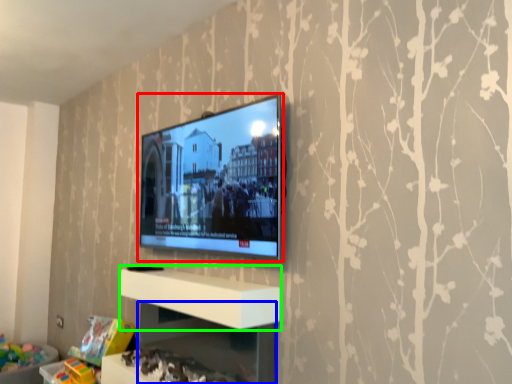
Question: Which is nearer to the television (highlighted by a red box)? shelf (highlighted by a blue box) or shelf (highlighted by a green box).

Choices:
 (A) shelf
 (B) shelf

Answer: (B)